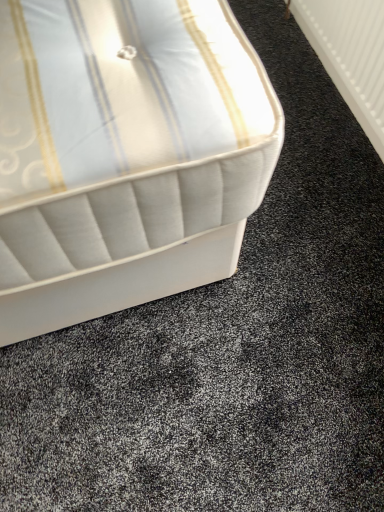
Question: Does white plastic radiator at upper right have a greater height compared to white fabric bed at upper left?

Choices:
 (A) yes
 (B) no

Answer: (A)

Question: From a real-world perspective, is white plastic radiator at upper right on top of white fabric bed at upper left?

Choices:
 (A) no
 (B) yes

Answer: (B)

Question: Is white plastic radiator at upper right closer to the viewer compared to white fabric bed at upper left?

Choices:
 (A) no
 (B) yes

Answer: (A)

Question: Is white plastic radiator at upper right positioned beyond the bounds of white fabric bed at upper left?

Choices:
 (A) no
 (B) yes

Answer: (B)

Question: Considering the relative sizes of white plastic radiator at upper right and white fabric bed at upper left in the image provided, is white plastic radiator at upper right smaller than white fabric bed at upper left?

Choices:
 (A) yes
 (B) no

Answer: (A)

Question: Would you say white plastic radiator at upper right is a long distance from white fabric bed at upper left?

Choices:
 (A) yes
 (B) no

Answer: (B)

Question: Is the position of white fabric bed at upper left less distant than that of white plastic radiator at upper right?

Choices:
 (A) yes
 (B) no

Answer: (A)

Question: Is white plastic radiator at upper right surrounded by white fabric bed at upper left?

Choices:
 (A) no
 (B) yes

Answer: (A)

Question: Does white fabric bed at upper left have a smaller size compared to white plastic radiator at upper right?

Choices:
 (A) yes
 (B) no

Answer: (B)

Question: Can you confirm if white fabric bed at upper left is bigger than white plastic radiator at upper right?

Choices:
 (A) no
 (B) yes

Answer: (B)

Question: Is white fabric bed at upper left taller than white plastic radiator at upper right?

Choices:
 (A) yes
 (B) no

Answer: (B)

Question: From the image's perspective, is white fabric bed at upper left located beneath white plastic radiator at upper right?

Choices:
 (A) yes
 (B) no

Answer: (A)

Question: From a real-world perspective, is white fabric bed at upper left above or below white plastic radiator at upper right?

Choices:
 (A) below
 (B) above

Answer: (A)